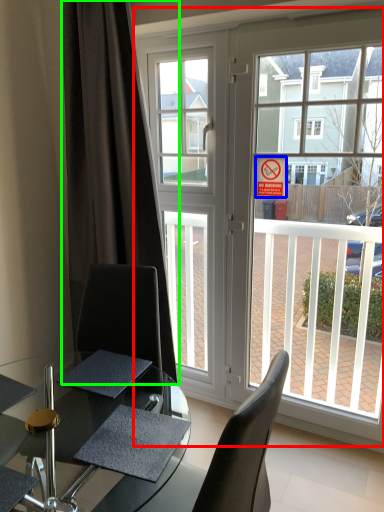
Question: Which object is positioned farthest from window (highlighted by a red box)? Select from parking sign (highlighted by a blue box) and curtain (highlighted by a green box).

Choices:
 (A) parking sign
 (B) curtain

Answer: (A)